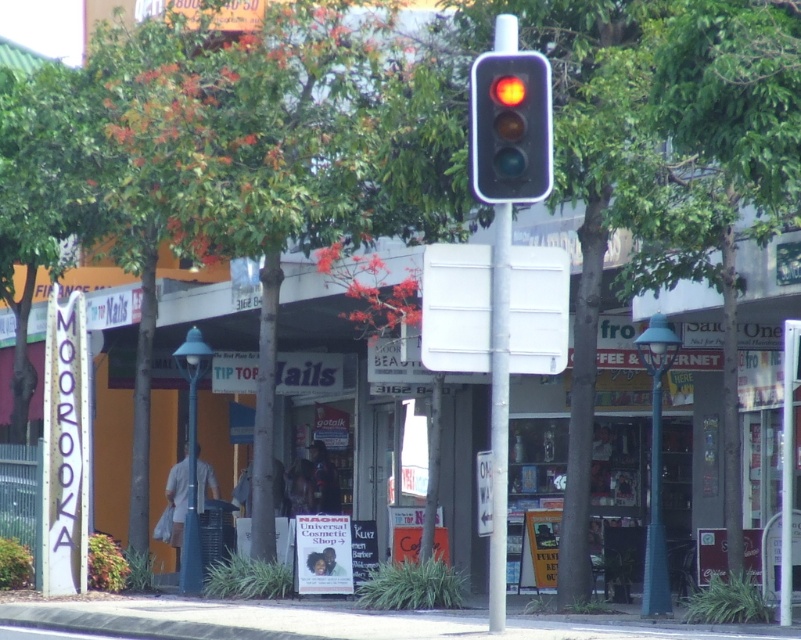
Question: Considering the relative positions of matte glass traffic light at center and metallic gray traffic light at center in the image provided, where is matte glass traffic light at center located with respect to metallic gray traffic light at center?

Choices:
 (A) right
 (B) left

Answer: (B)

Question: Does matte glass traffic light at center appear on the right side of metallic gray traffic light at center?

Choices:
 (A) yes
 (B) no

Answer: (B)

Question: Does matte glass traffic light at center have a lesser width compared to metallic gray traffic light at center?

Choices:
 (A) yes
 (B) no

Answer: (A)

Question: Which point is farther to the camera?

Choices:
 (A) metallic gray traffic light at center
 (B) matte glass traffic light at center

Answer: (A)